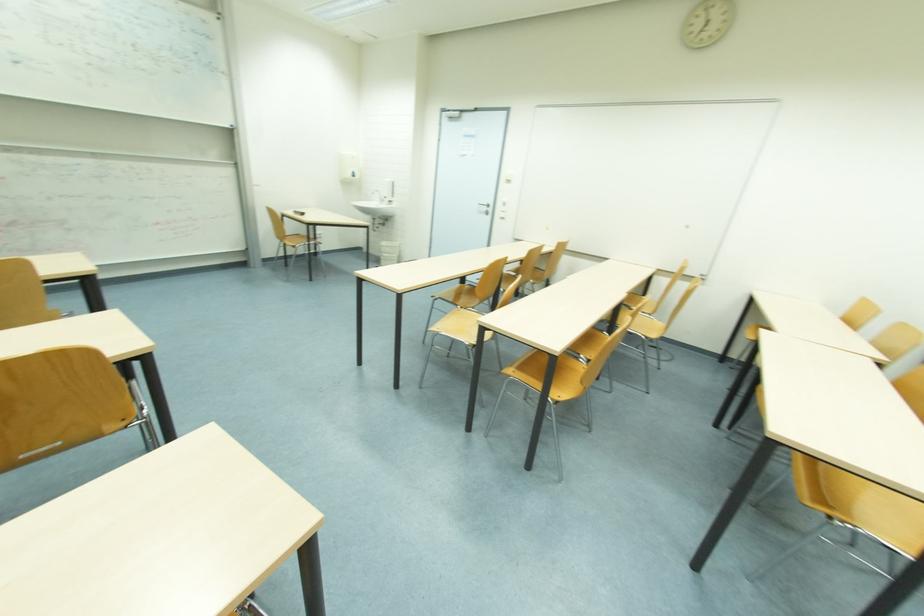
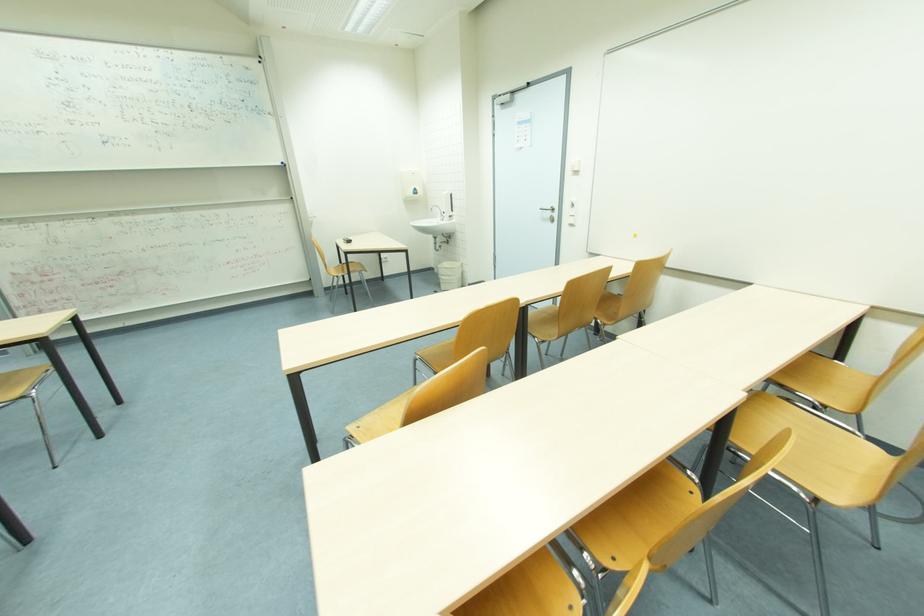
In a continuous first-person perspective shot, in which direction is the camera moving?

The movement direction of the cameraman is right, forward.